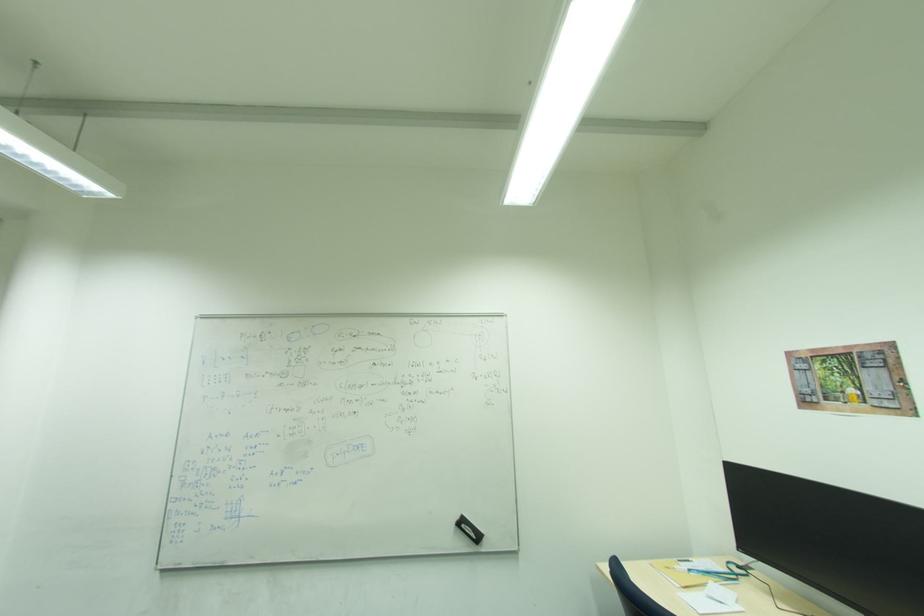
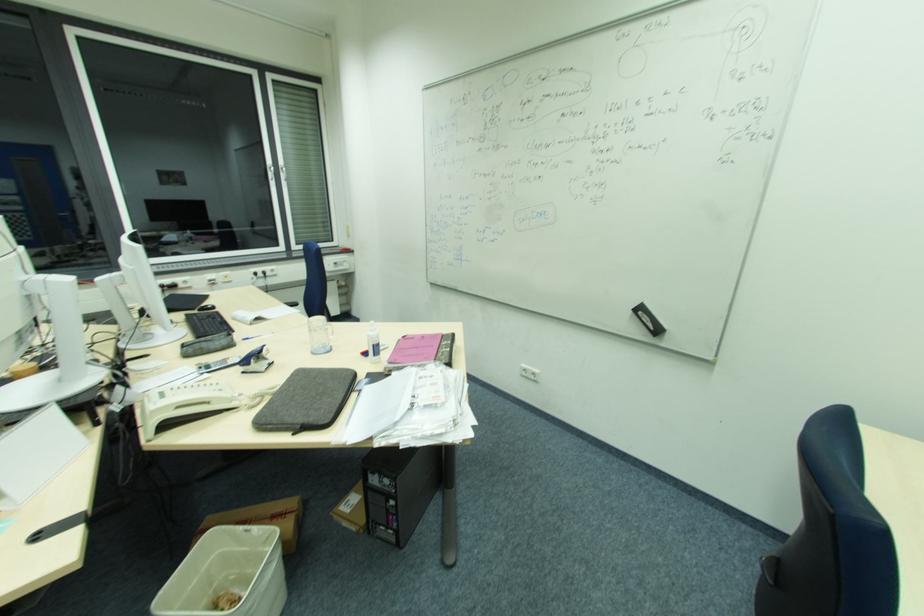
How did the camera likely rotate?

The rotation direction of the camera is left-down.